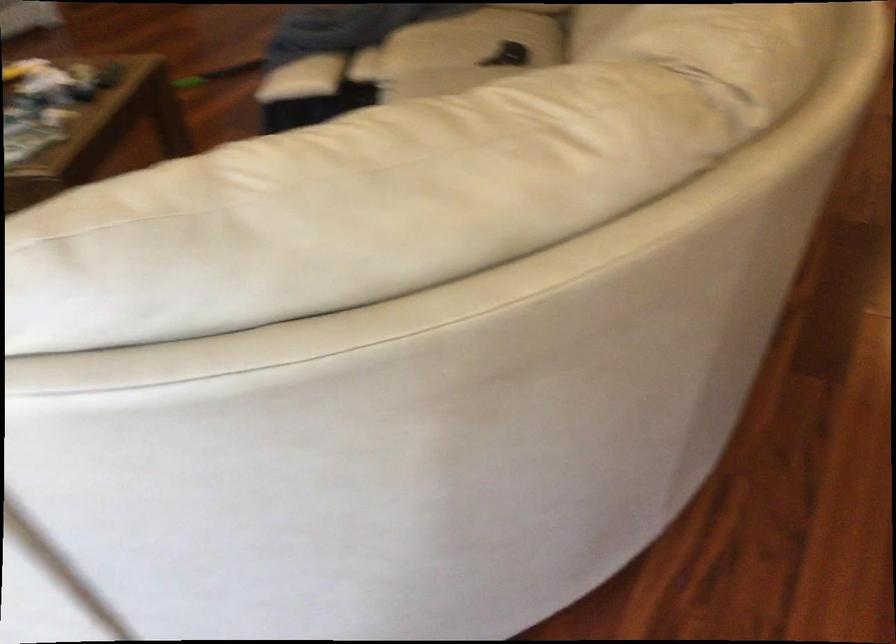
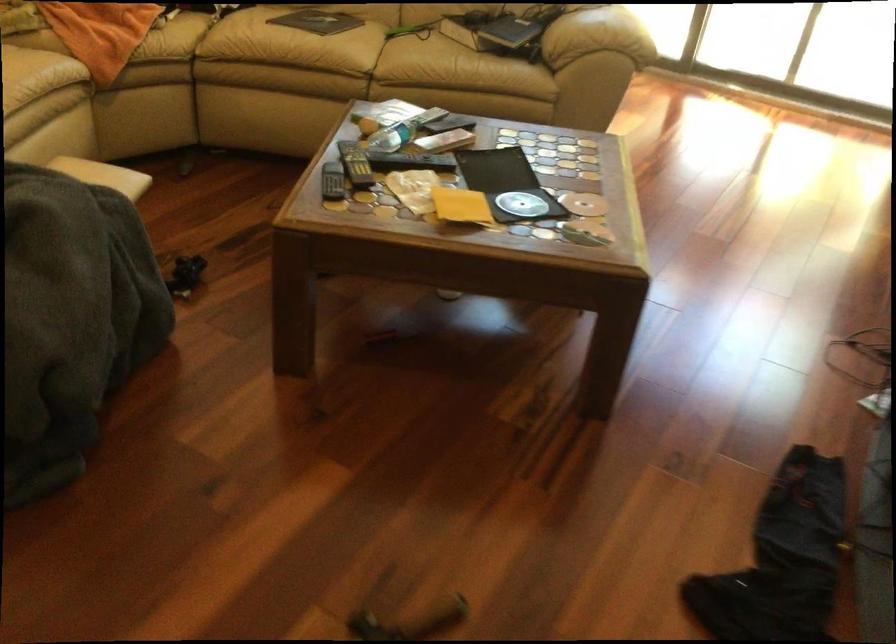
The point at (99, 71) is marked in the first image. Where is the corresponding point in the second image?

(332, 182)